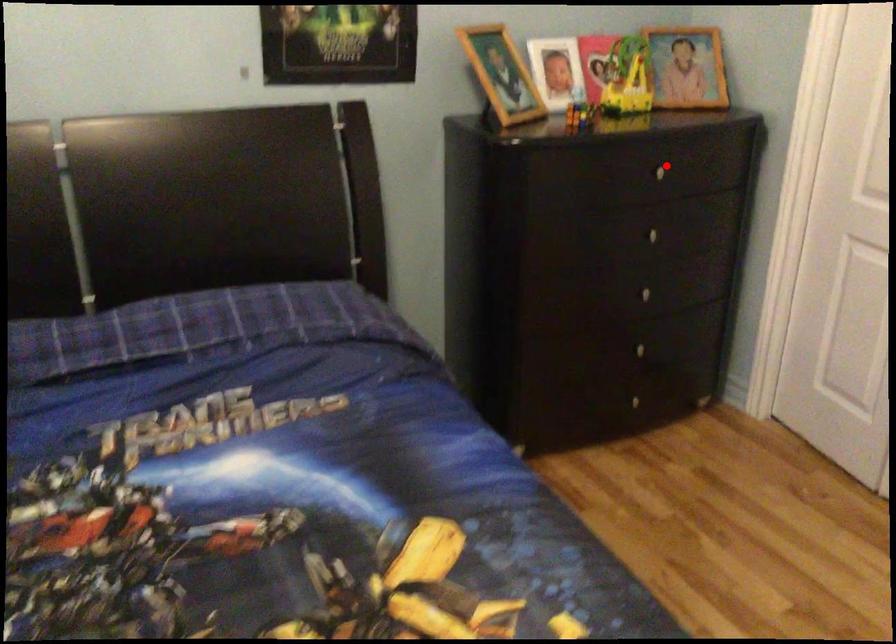
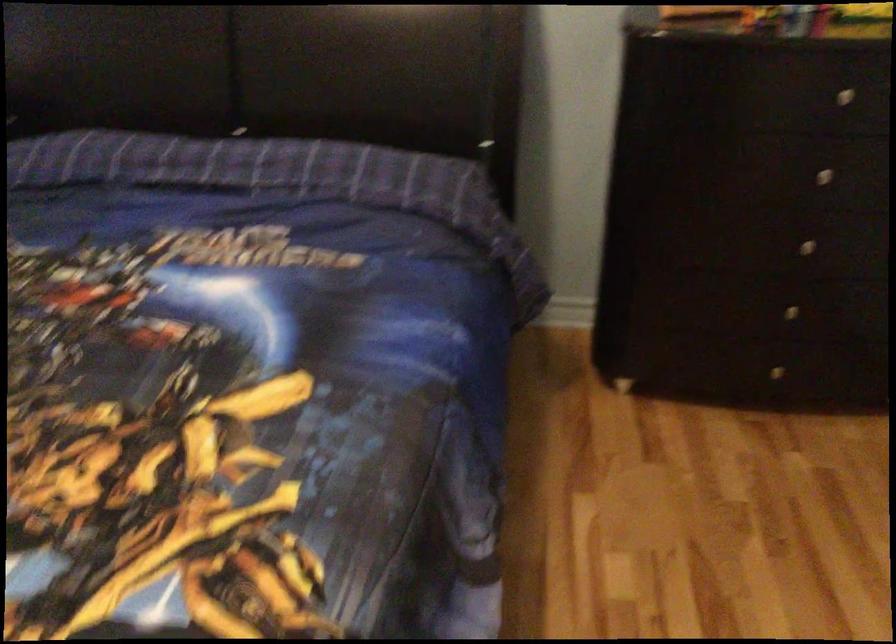
Find the pixel in the second image that matches the highlighted location in the first image.

(858, 91)